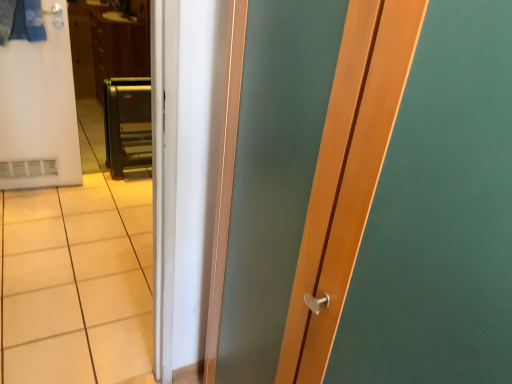
Question: Does brown wood dresser at upper left have a larger size compared to white matte refrigerator at left?

Choices:
 (A) yes
 (B) no

Answer: (A)

Question: Does brown wood dresser at upper left have a greater width compared to white matte refrigerator at left?

Choices:
 (A) no
 (B) yes

Answer: (B)

Question: Is brown wood dresser at upper left looking in the opposite direction of white matte refrigerator at left?

Choices:
 (A) yes
 (B) no

Answer: (B)

Question: Is brown wood dresser at upper left next to white matte refrigerator at left and touching it?

Choices:
 (A) yes
 (B) no

Answer: (B)

Question: Can you confirm if brown wood dresser at upper left is positioned to the right of white matte refrigerator at left?

Choices:
 (A) no
 (B) yes

Answer: (B)

Question: Considering the positions of white matte refrigerator at left and brown wood dresser at upper left in the image, is white matte refrigerator at left taller or shorter than brown wood dresser at upper left?

Choices:
 (A) short
 (B) tall

Answer: (B)

Question: Is white matte refrigerator at left situated inside brown wood dresser at upper left or outside?

Choices:
 (A) outside
 (B) inside

Answer: (A)

Question: Relative to brown wood dresser at upper left, is white matte refrigerator at left in front or behind?

Choices:
 (A) front
 (B) behind

Answer: (A)

Question: Based on their sizes in the image, would you say white matte refrigerator at left is bigger or smaller than brown wood dresser at upper left?

Choices:
 (A) big
 (B) small

Answer: (B)

Question: Does point (134, 129) appear closer or farther from the camera than point (50, 18)?

Choices:
 (A) closer
 (B) farther

Answer: (B)

Question: Relative to white matte refrigerator at left, is metallic gray step ladder at center in front or behind?

Choices:
 (A) front
 (B) behind

Answer: (B)

Question: Based on their positions, is metallic gray step ladder at center located to the left or right of white matte refrigerator at left?

Choices:
 (A) right
 (B) left

Answer: (A)

Question: From the image's perspective, relative to white matte refrigerator at left, is metallic gray step ladder at center above or below?

Choices:
 (A) below
 (B) above

Answer: (A)

Question: Looking at the image, does brown wood dresser at upper left seem bigger or smaller compared to white matte refrigerator at left?

Choices:
 (A) small
 (B) big

Answer: (B)

Question: Considering their positions, is brown wood dresser at upper left located in front of or behind white matte refrigerator at left?

Choices:
 (A) front
 (B) behind

Answer: (B)